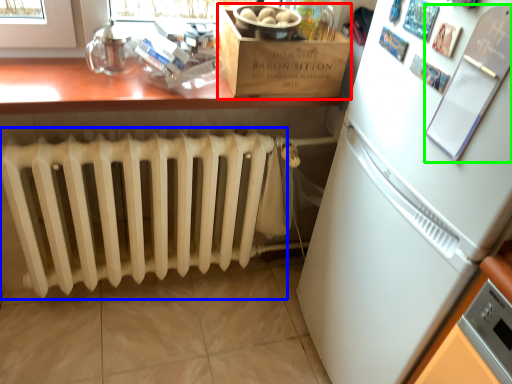
Question: Considering the real-world distances, which object is closest to cardboard box (highlighted by a red box)? radiator (highlighted by a blue box) or bulletin board (highlighted by a green box).

Choices:
 (A) radiator
 (B) bulletin board

Answer: (A)